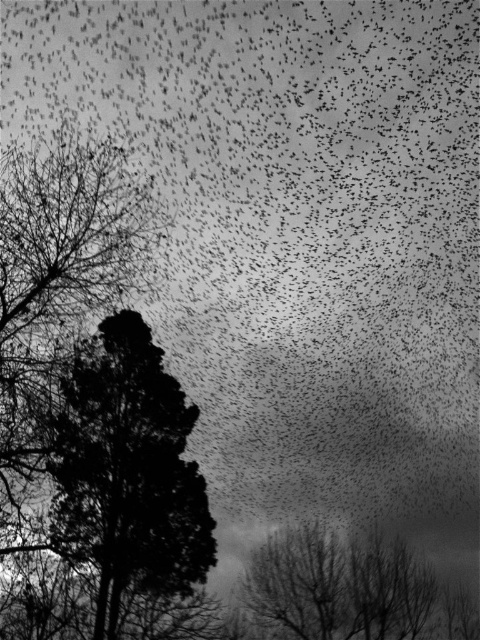
Question: Which of the following is the closest to the observer?

Choices:
 (A) (372, 608)
 (B) (187, 515)

Answer: (B)

Question: In this image, where is black textured tree at center located relative to bare branches at lower center?

Choices:
 (A) left
 (B) right

Answer: (A)

Question: Can you confirm if black textured tree at center is thinner than bare branches at lower center?

Choices:
 (A) no
 (B) yes

Answer: (B)

Question: Is black textured tree at center above bare branches at lower center?

Choices:
 (A) yes
 (B) no

Answer: (A)